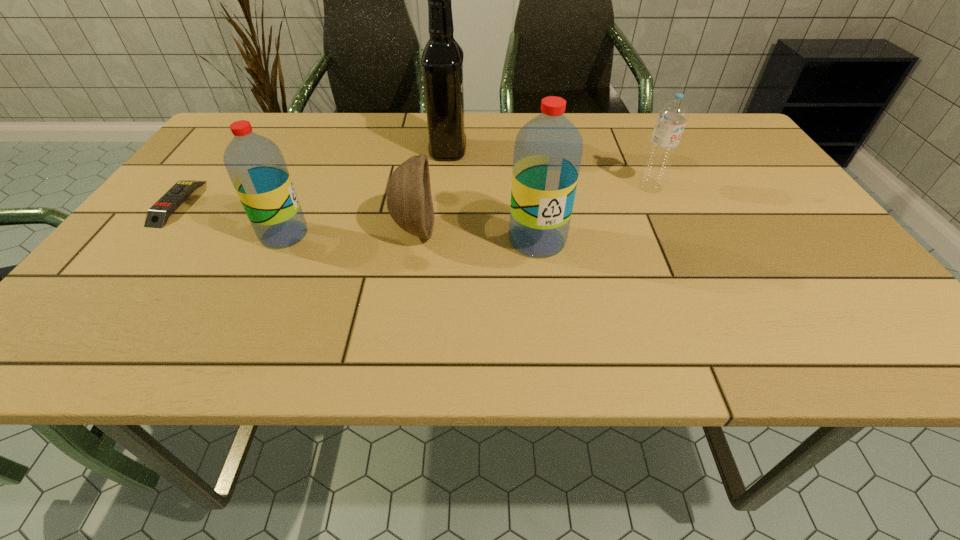
Given the evenly spaced water bottles in the image, where should an extra water bottle be added on the right to preserve the spacing? Please point to a vacant space. Please provide its 2D coordinates. Your answer should be formatted as a tuple, i.e. [(x, y)], where the tuple contains the x and y coordinates of a point satisfying the conditions above.

[(798, 246)]